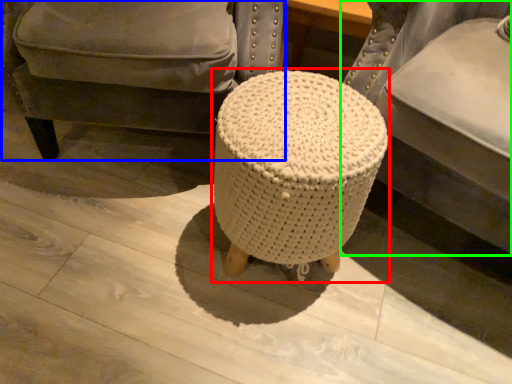
Question: Based on their relative distances, which object is farther from bar stool (highlighted by a red box)? Choose from chair (highlighted by a blue box) and furniture (highlighted by a green box).

Choices:
 (A) chair
 (B) furniture

Answer: (A)